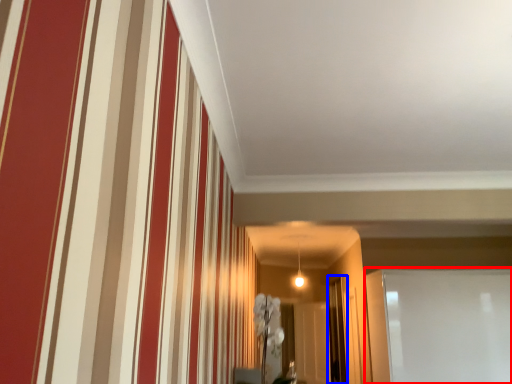
Question: Which of the following is the closest to the observer, glass door (highlighted by a red box) or glass door (highlighted by a blue box)?

Choices:
 (A) glass door
 (B) glass door

Answer: (A)